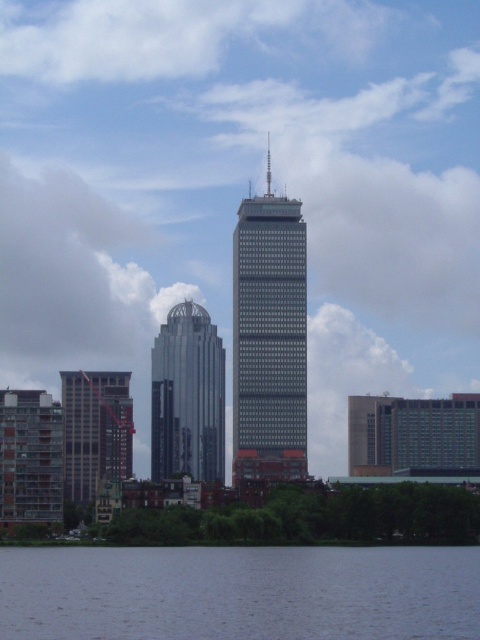
You are a drone operator trying to capture a photo of the John Hancock Tower and the Millennium Tower. You are currently hovering at the point marked by the coordinate point [240,593]. Based on your current position, which direction should you fly to get a better view of the two towers?

The point [240,593] corresponds to the blue water at lower center. To get a better view of the John Hancock Tower in the center and the Millennium Tower to its left, you should fly north away from the blue water at lower center towards the buildings.

In the scene shown: You are a photographer planning to capture the entire John Hancock Tower and the rounded dome building in your shot. You are currently standing at the camera position. Is the blue water at lower center within your shooting range if your camera has a maximum range of 600 meters?

The blue water at lower center and camera are 651.57 meters apart, which exceeds the camera maximum range of 600 meters. Therefore, the blue water at lower center is out of the shooting range.